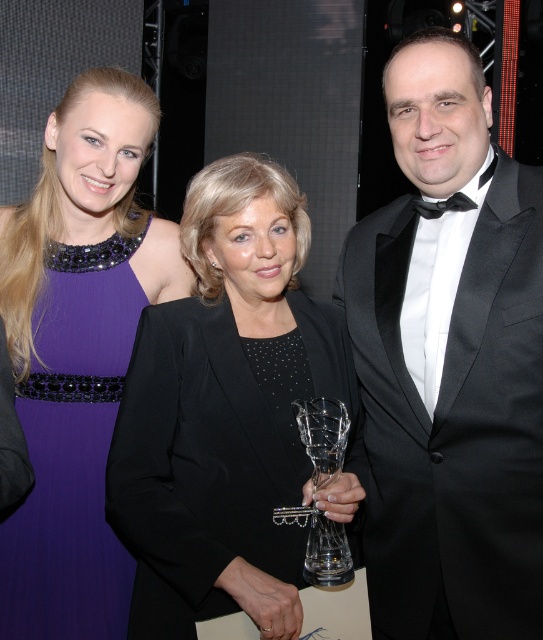
Does black satin blazer at center have a larger size compared to clear glass trophy at center?

Indeed, black satin blazer at center has a larger size compared to clear glass trophy at center.

Does black satin blazer at center lie in front of clear glass trophy at center?

Yes.

Where is `black satin blazer at center`? The height and width of the screenshot is (640, 543). black satin blazer at center is located at coordinates (228, 413).

Is black satin blazer at center bigger than purple satin dress at upper left?

Yes, black satin blazer at center is bigger than purple satin dress at upper left.

Who is taller, black satin blazer at center or purple satin dress at upper left?

With more height is purple satin dress at upper left.

Is point (192, 205) positioned in front of point (22, 280)?

Yes, point (192, 205) is in front of point (22, 280).

I want to click on black satin blazer at center, so click(228, 413).

Can you confirm if purple satin dress at upper left is thinner than clear glass trophy at center?

No, purple satin dress at upper left is not thinner than clear glass trophy at center.

Measure the distance from purple satin dress at upper left to clear glass trophy at center.

purple satin dress at upper left and clear glass trophy at center are 20.53 inches apart.

Who is more forward, [53,204] or [336,525]?

Point [336,525]

I want to click on purple satin dress at upper left, so click(78, 349).